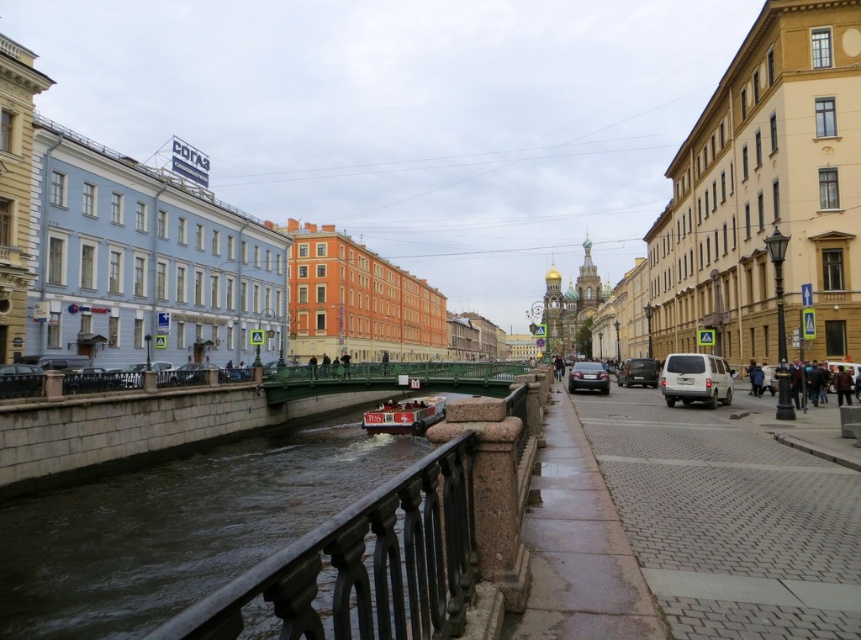
Question: Estimate the real-world distances between objects in this image. Which object is closer to the satin black car at center?

Choices:
 (A) satin black van at center
 (B) dark brown leather jacket at lower right

Answer: (A)

Question: Is satin black van at center to the left of dark brown leather jacket at lower right from the viewer's perspective?

Choices:
 (A) no
 (B) yes

Answer: (B)

Question: Which point is farther to the camera?

Choices:
 (A) (676, 380)
 (B) (580, 381)
 (C) (767, 380)
 (D) (618, 380)

Answer: (D)

Question: Is green metallic bridge at center bigger than dark brown leather jacket at lower right?

Choices:
 (A) no
 (B) yes

Answer: (B)

Question: Estimate the real-world distances between objects in this image. Which object is closer to the black polished metal railing at center?

Choices:
 (A) satin black car at center
 (B) satin black van at center
 (C) green metallic bridge at center
 (D) metallic red boat at center

Answer: (C)

Question: Considering the relative positions of white matte van at center and satin black car at center in the image provided, where is white matte van at center located with respect to satin black car at center?

Choices:
 (A) below
 (B) above

Answer: (B)